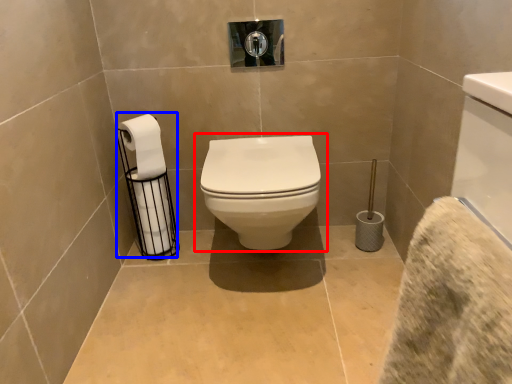
Question: Among these objects, which one is farthest to the camera, toilet (highlighted by a red box) or toilet paper (highlighted by a blue box)?

Choices:
 (A) toilet
 (B) toilet paper

Answer: (B)